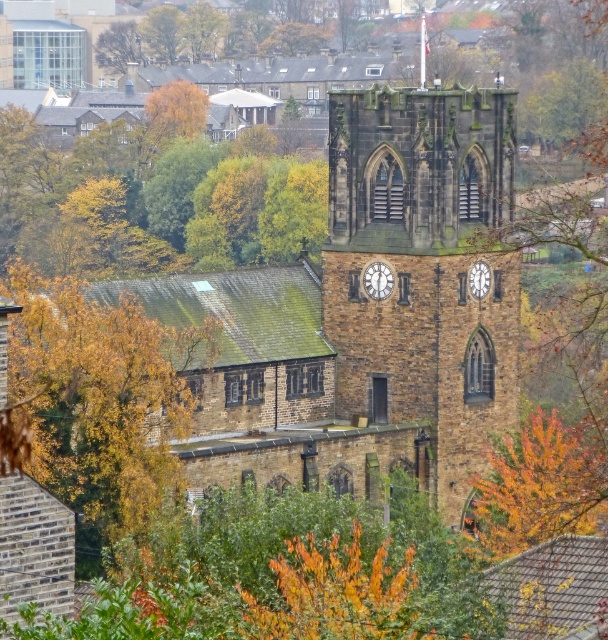
Question: Does brown wood tree at upper center have a larger size compared to matte stone clock at center?

Choices:
 (A) yes
 (B) no

Answer: (A)

Question: Can you confirm if autumn leaves at center is positioned above white stone clock at upper center?

Choices:
 (A) yes
 (B) no

Answer: (B)

Question: Which is nearer to the green leafy tree at upper center?

Choices:
 (A) autumn leaves at center
 (B) white stone clock at upper center
 (C) matte stone clock at center

Answer: (C)

Question: Is green leafy tree at upper center behind matte stone clock at center?

Choices:
 (A) no
 (B) yes

Answer: (B)

Question: Considering the real-world distances, which object is farthest from the matte stone clock at center?

Choices:
 (A) autumn leaves at center
 (B) green leafy tree at upper center

Answer: (B)

Question: Which object is the farthest from the autumn leaves at center?

Choices:
 (A) brown wood tree at upper center
 (B) green leafy tree at upper center
 (C) white stone clock at upper center
 (D) golden leafy tree at center

Answer: (A)